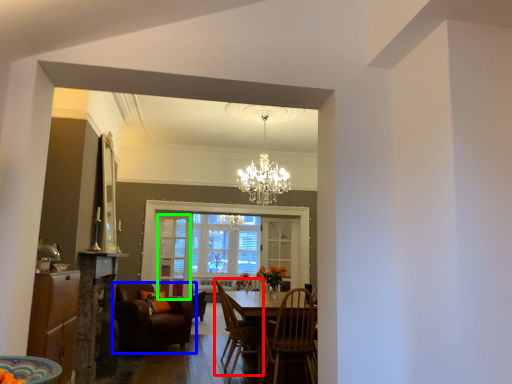
Question: Considering the real-world distances, which object is closest to chair (highlighted by a red box)? chair (highlighted by a blue box) or glass door (highlighted by a green box).

Choices:
 (A) chair
 (B) glass door

Answer: (A)